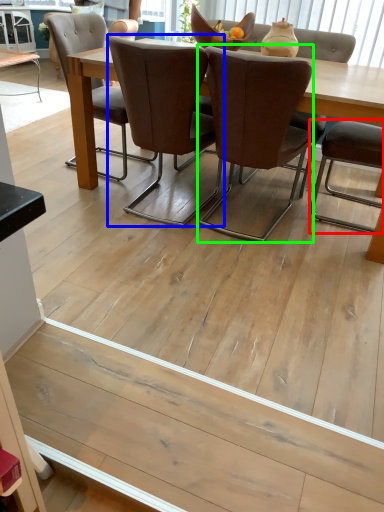
Question: Estimate the real-world distances between objects in this image. Which object is closer to chair (highlighted by a red box), chair (highlighted by a blue box) or chair (highlighted by a green box)?

Choices:
 (A) chair
 (B) chair

Answer: (B)